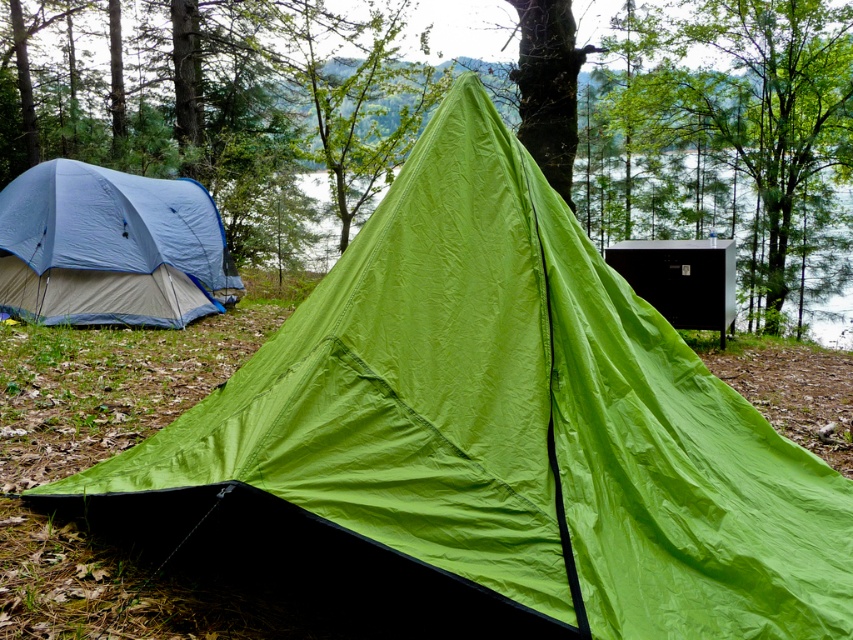
Can you confirm if green fabric tent at center is positioned above green matte tree at upper right?

No.

Does green fabric tent at center appear under green matte tree at upper right?

Yes, green fabric tent at center is below green matte tree at upper right.

Does point (718, 234) come in front of point (718, 115)?

No, (718, 234) is further to viewer.

You are a GUI agent. You are given a task and a screenshot of the screen. Output one action in this format:
    pyautogui.click(x=<x>, y=<y>)
    Task: Click on the green fabric tent at center
    Image resolution: width=853 pixels, height=640 pixels.
    Given the screenshot: What is the action you would take?
    pyautogui.click(x=700, y=132)

Is green fabric tent at center smaller than matte blue tent at left?

Actually, green fabric tent at center might be larger than matte blue tent at left.

Who is higher up, green fabric tent at center or matte blue tent at left?

Positioned higher is green fabric tent at center.

Describe the element at coordinates (700, 132) in the screenshot. I see `green fabric tent at center` at that location.

Find the location of a particular element. This screenshot has width=853, height=640. green fabric tent at center is located at coordinates (700, 132).

Consider the image. Who is higher up, green matte tree at upper right or matte blue tent at left?

green matte tree at upper right is higher up.

Does green matte tree at upper right appear over matte blue tent at left?

Indeed, green matte tree at upper right is positioned over matte blue tent at left.

Between point (624, 115) and point (61, 163), which one is positioned in front?

Positioned in front is point (61, 163).

The height and width of the screenshot is (640, 853). In order to click on green matte tree at upper right in this screenshot , I will do `click(753, 115)`.